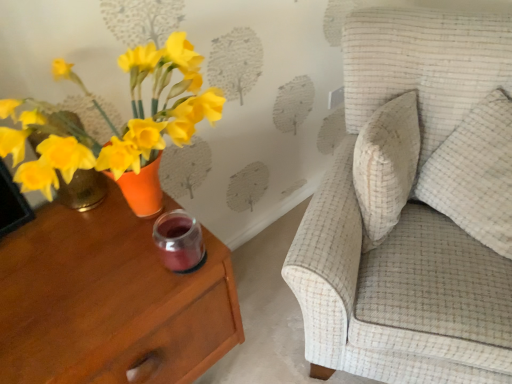
Question: From a real-world perspective, relative to white textured pillow at right, is matte wood nightstand at left vertically above or below?

Choices:
 (A) above
 (B) below

Answer: (B)

Question: Considering the positions of matte wood nightstand at left and white textured pillow at right in the image, is matte wood nightstand at left taller or shorter than white textured pillow at right?

Choices:
 (A) tall
 (B) short

Answer: (A)

Question: Which object is the farthest from the matte wood nightstand at left?

Choices:
 (A) white textured pillow at right
 (B) textured beige sofa at upper right

Answer: (A)

Question: Which of these objects is positioned closest to the matte wood nightstand at left?

Choices:
 (A) textured beige sofa at upper right
 (B) white textured pillow at right

Answer: (A)